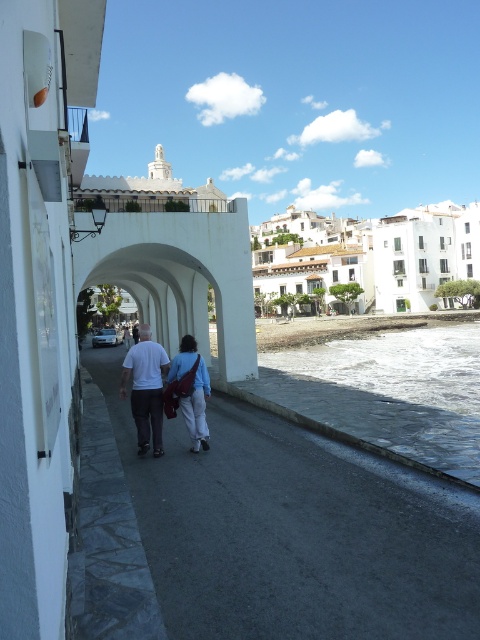
Question: Does white matte shirt at center have a smaller size compared to blue fabric bag at center?

Choices:
 (A) yes
 (B) no

Answer: (B)

Question: Does white matte bridge at center appear over blue fabric bag at center?

Choices:
 (A) no
 (B) yes

Answer: (B)

Question: Among these points, which one is farthest from the camera?

Choices:
 (A) (203, 449)
 (B) (433, 490)
 (C) (164, 358)

Answer: (A)

Question: Which of the following is the farthest from the observer?

Choices:
 (A) (235, 216)
 (B) (288, 534)
 (C) (137, 362)

Answer: (A)

Question: Which of the following is the closest to the observer?

Choices:
 (A) (159, 419)
 (B) (194, 289)

Answer: (A)

Question: Is gray concrete pavement at center above white matte shirt at center?

Choices:
 (A) yes
 (B) no

Answer: (B)